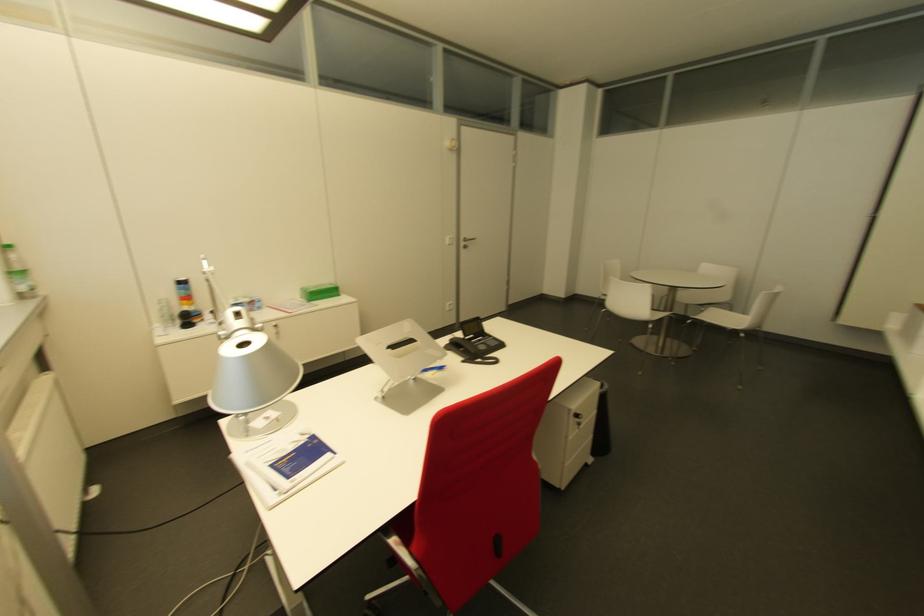
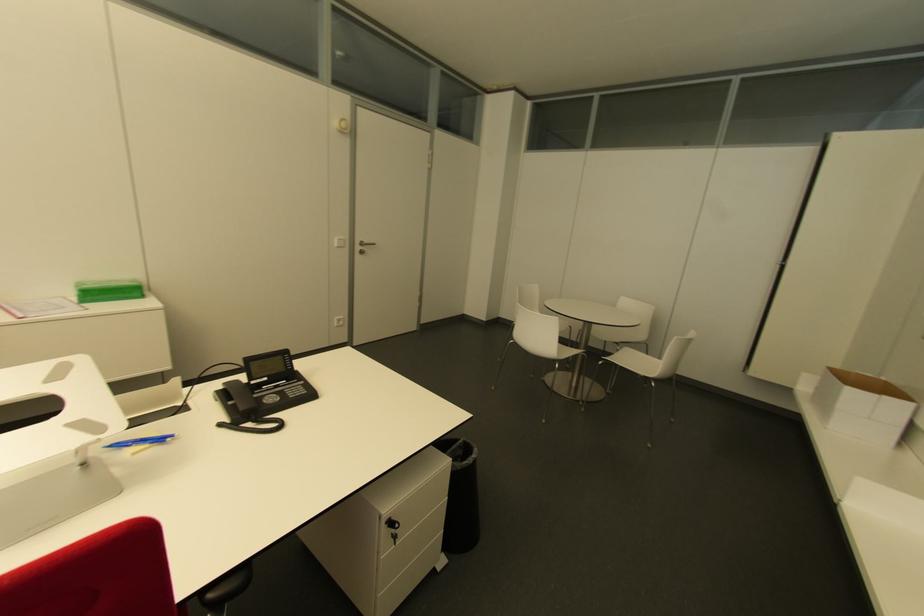
Find the pixel in the second image that matches (579,418) in the first image.

(394, 525)